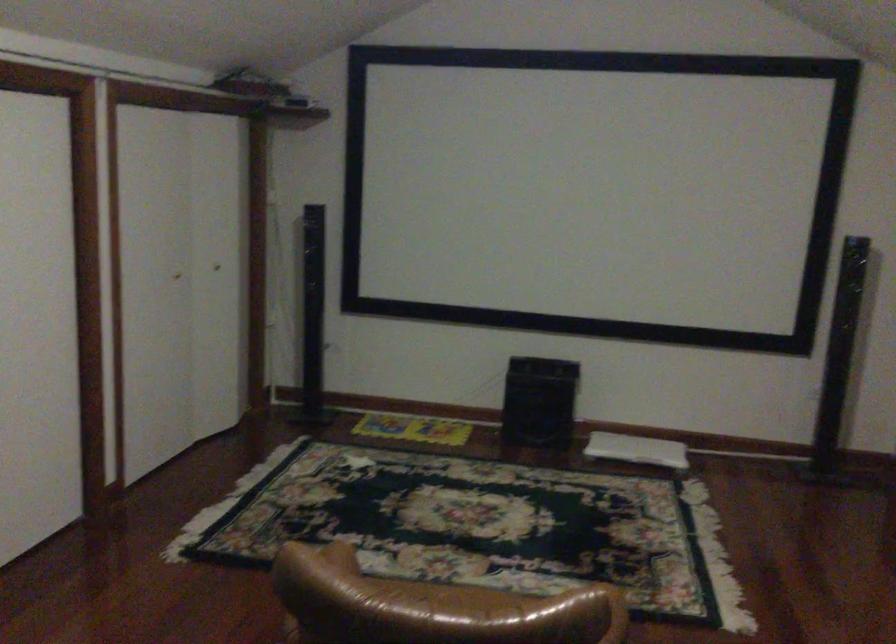
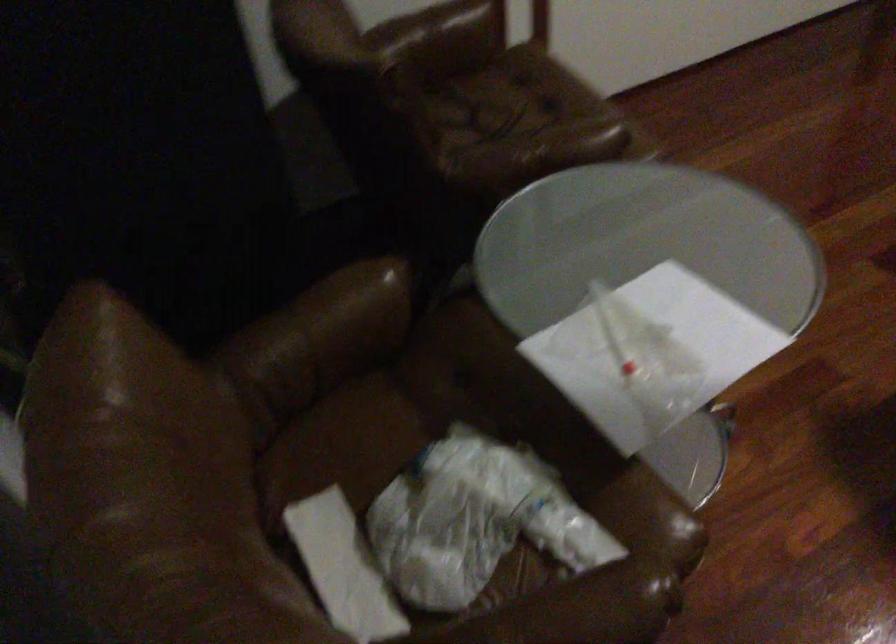
The first image is from the beginning of the video and the second image is from the end. How did the camera likely rotate when shooting the video?

The camera rotated toward left-down.